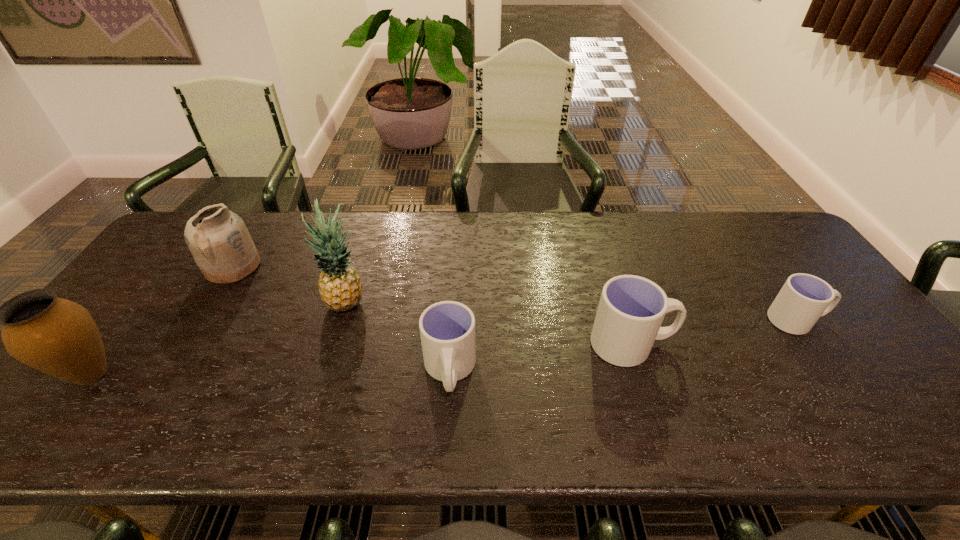
Please point a spot to add another cup on the left. Please provide its 2D coordinates. Your answer should be formatted as a tuple, i.e. [(x, y)], where the tuple contains the x and y coordinates of a point satisfying the conditions above.

[(245, 400)]